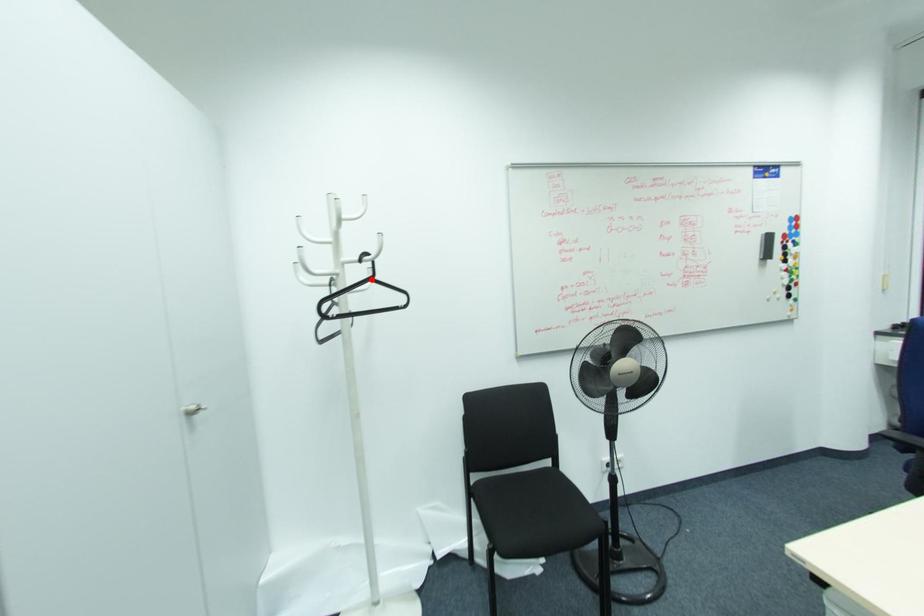
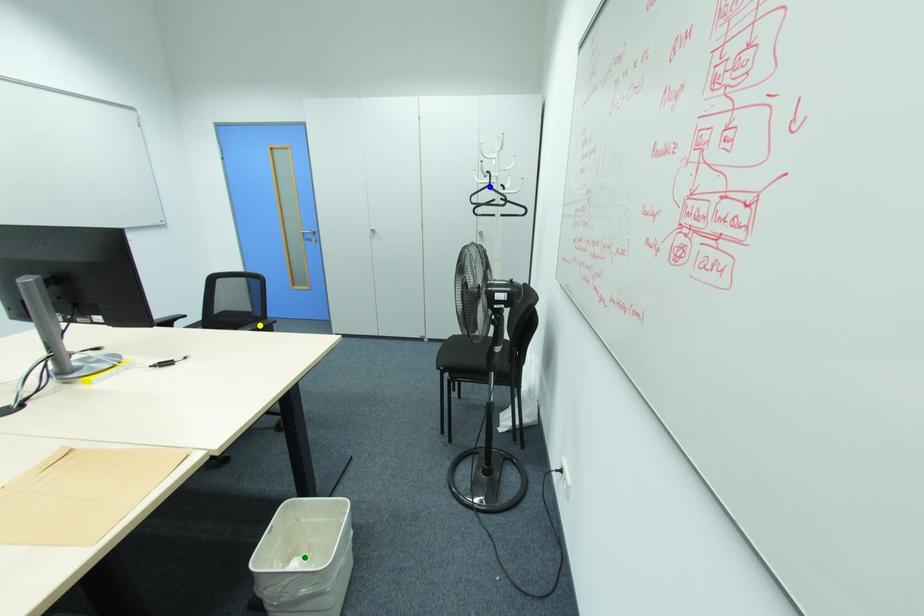
Question: I am providing you with two images of the same scene from different viewpoints. A red point is marked on the first image. You are given multiple points on the second image. In image 2, which mark is for the same physical point as the one in image 1?

Choices:
 (A) blue point
 (B) yellow point
 (C) green point

Answer: (A)